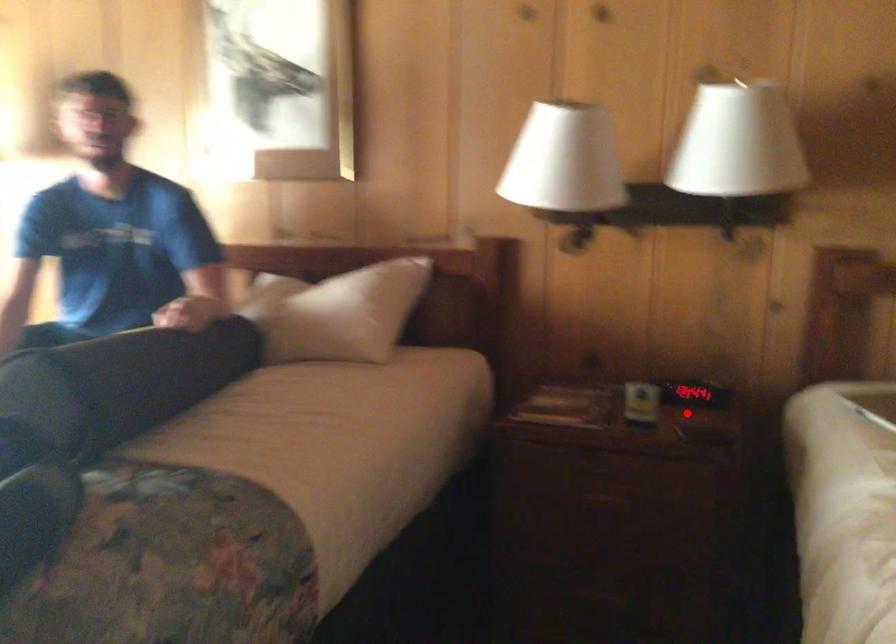
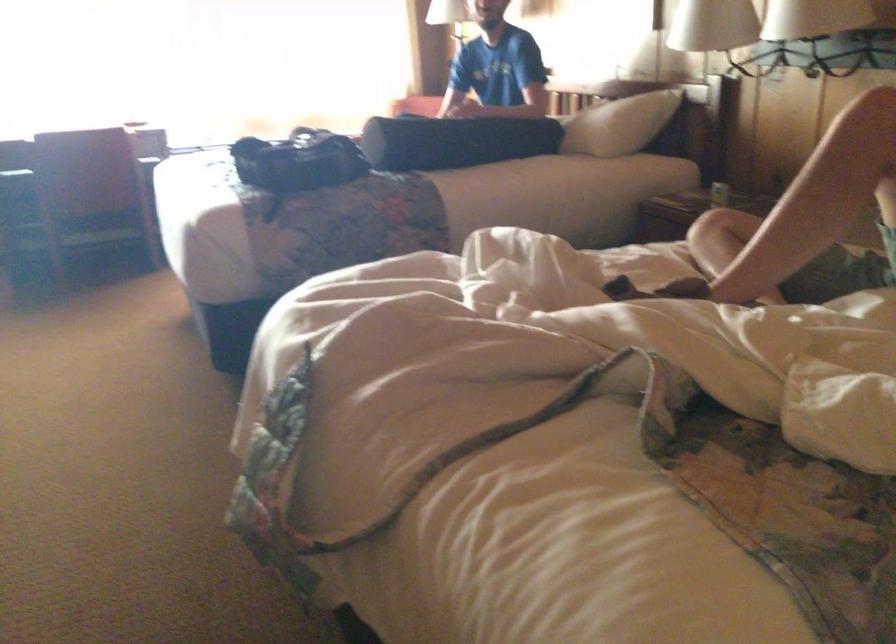
Question: I am providing you with two images of the same scene from different viewpoints. A red point is marked on the first image. Is the red point's position out of view in image 2?

Choices:
 (A) Yes
 (B) No

Answer: (B)